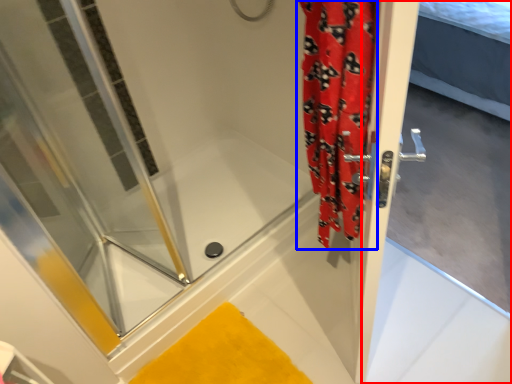
Question: Among these objects, which one is nearest to the camera, screen door (highlighted by a red box) or shower curtain (highlighted by a blue box)?

Choices:
 (A) screen door
 (B) shower curtain

Answer: (B)